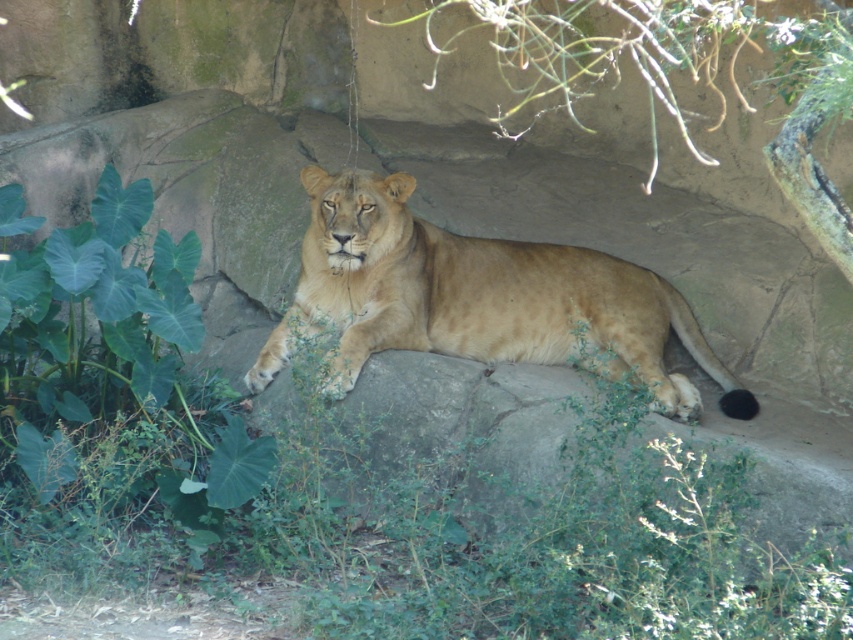
You are a zookeeper observing the golden fur lion at center and the green leafy plant at lower left in the enclosure. Which object takes up more space in the image?

The green leafy plant at lower left has a larger size compared to the golden fur lion at center, so it takes up more space in the image.

You are a zookeeper planning to water the green leafy plant at lower left and the golden fur lion at center. Which object requires more water based on their sizes?

The green leafy plant at lower left requires more water because its width surpasses that of the golden fur lion at center, indicating it may need more water to maintain its size.